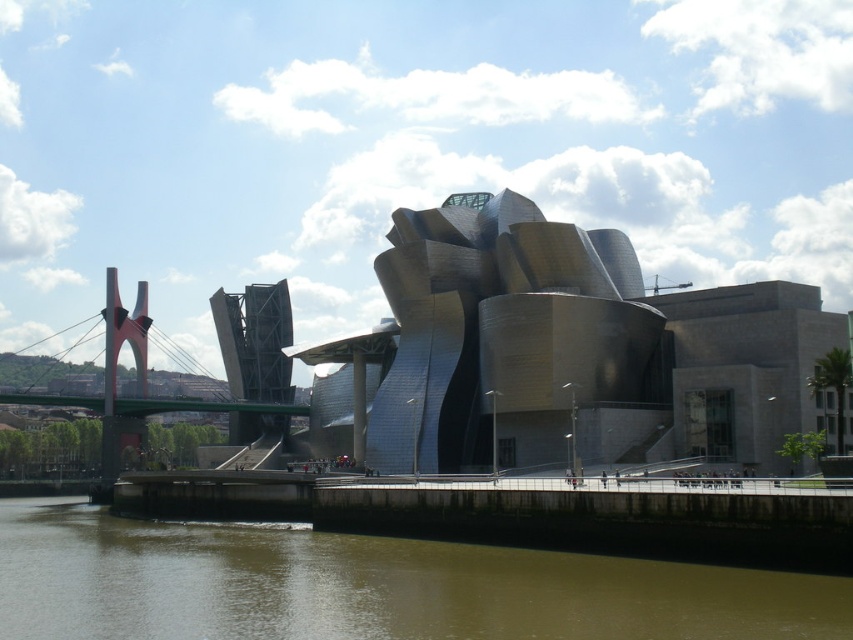
Question: Can you confirm if metallic silver building at center is thinner than green metallic bridge at left?

Choices:
 (A) no
 (B) yes

Answer: (B)

Question: Can you confirm if brown sedimentary water at lower center is positioned above green metallic bridge at left?

Choices:
 (A) no
 (B) yes

Answer: (A)

Question: Which object is farther from the camera taking this photo?

Choices:
 (A) brown sedimentary water at lower center
 (B) metallic silver building at center
 (C) green metallic bridge at left

Answer: (C)

Question: Estimate the real-world distances between objects in this image. Which object is farther from the metallic silver building at center?

Choices:
 (A) brown sedimentary water at lower center
 (B) green metallic bridge at left

Answer: (B)

Question: Which of the following is the closest to the observer?

Choices:
 (A) (717, 420)
 (B) (293, 385)

Answer: (A)

Question: Is metallic silver building at center bigger than green metallic bridge at left?

Choices:
 (A) no
 (B) yes

Answer: (A)